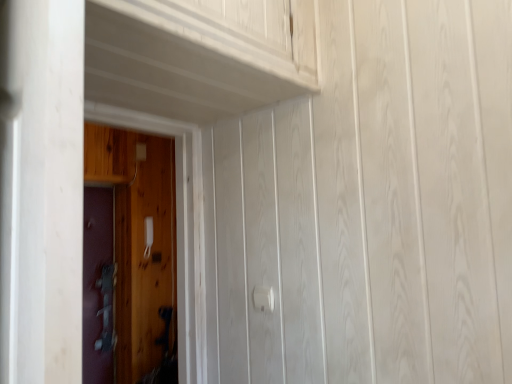
What is the approximate height of white plastic door handle at center?

white plastic door handle at center is 3.18 inches tall.

What is the approximate width of wooden door at left, which is counted as the first door, starting from the front?

wooden door at left, which is counted as the first door, starting from the front, is 5.66 inches wide.

This screenshot has height=384, width=512. I want to click on metallic gray door at left, the 2th door positioned from the right, so click(x=95, y=279).

Is wooden door at left, the 1th door viewed from the right, placed right next to metallic gray door at left, the 2th door positioned from the right?

No, wooden door at left, the 1th door viewed from the right, is not in contact with metallic gray door at left, the 2th door positioned from the right.

How distant is wooden door at left, the 1th door viewed from the right, from metallic gray door at left, which is counted as the 2th door, starting from the front?

wooden door at left, the 1th door viewed from the right, and metallic gray door at left, which is counted as the 2th door, starting from the front, are 9.83 inches apart from each other.

Looking at this image, is wooden door at left, marked as the second door in a back-to-front arrangement, further to camera compared to metallic gray door at left, the first door viewed from the left?

No, wooden door at left, marked as the second door in a back-to-front arrangement, is closer to the camera.

Does wooden door at left, the 2th door in the left-to-right sequence, have a greater width compared to metallic gray door at left, acting as the 1th door starting from the back?

Yes.

Is white plastic door handle at center inside the boundaries of metallic gray door at left, the 2th door positioned from the right, or outside?

white plastic door handle at center is spatially situated outside metallic gray door at left, the 2th door positioned from the right.

Based on their positions, is white plastic door handle at center located to the left or right of metallic gray door at left, acting as the 1th door starting from the back?

Based on their positions, white plastic door handle at center is located to the right of metallic gray door at left, acting as the 1th door starting from the back.

What's the angular difference between white plastic door handle at center and metallic gray door at left, the 2th door positioned from the right,'s facing directions?

white plastic door handle at center and metallic gray door at left, the 2th door positioned from the right, are facing 88.1 degrees away from each other.

Is white plastic door handle at center aimed at metallic gray door at left, the first door viewed from the left?

No, white plastic door handle at center is not aimed at metallic gray door at left, the first door viewed from the left.

Is wooden door at left, the 1th door viewed from the right, in front of or behind white plastic door handle at center in the image?

wooden door at left, the 1th door viewed from the right, is in front of white plastic door handle at center.

Between wooden door at left, marked as the second door in a back-to-front arrangement, and white plastic door handle at center, which one appears on the right side from the viewer's perspective?

Positioned to the right is white plastic door handle at center.

How many degrees apart are the facing directions of wooden door at left, marked as the second door in a back-to-front arrangement, and white plastic door handle at center?

89.7 degrees.

From the image's perspective, which is above, wooden door at left, which is counted as the first door, starting from the front, or white plastic door handle at center?

wooden door at left, which is counted as the first door, starting from the front, is shown above in the image.

Which of these two, metallic gray door at left, the first door viewed from the left, or wooden door at left, the 1th door viewed from the right, is bigger?

wooden door at left, the 1th door viewed from the right.

From a real-world perspective, who is located higher, metallic gray door at left, the 2th door positioned from the right, or wooden door at left, marked as the second door in a back-to-front arrangement?

From a 3D spatial view, wooden door at left, marked as the second door in a back-to-front arrangement, is above.

Relative to wooden door at left, which is counted as the first door, starting from the front, is metallic gray door at left, acting as the 1th door starting from the back, in front or behind?

metallic gray door at left, acting as the 1th door starting from the back, is positioned farther from the viewer than wooden door at left, which is counted as the first door, starting from the front.

From the image's perspective, which one is positioned higher, metallic gray door at left, the 2th door positioned from the right, or wooden door at left, which is counted as the first door, starting from the front?

wooden door at left, which is counted as the first door, starting from the front, from the image's perspective.

Which is correct: metallic gray door at left, the 2th door positioned from the right, is inside white plastic door handle at center, or outside of it?

metallic gray door at left, the 2th door positioned from the right, exists outside the volume of white plastic door handle at center.

Considering the sizes of objects metallic gray door at left, the first door viewed from the left, and white plastic door handle at center in the image provided, who is wider, metallic gray door at left, the first door viewed from the left, or white plastic door handle at center?

metallic gray door at left, the first door viewed from the left.

Which is closer, (x=86, y=357) or (x=269, y=298)?

Point (x=86, y=357) is farther from the camera than point (x=269, y=298).

From a real-world perspective, which is physically above, metallic gray door at left, the 2th door positioned from the right, or white plastic door handle at center?

white plastic door handle at center, from a real-world perspective.

Considering the sizes of objects white plastic door handle at center and wooden door at left, which is counted as the first door, starting from the front, in the image provided, who is thinner, white plastic door handle at center or wooden door at left, which is counted as the first door, starting from the front,?

Thinner between the two is white plastic door handle at center.

Considering the sizes of objects white plastic door handle at center and wooden door at left, the 1th door viewed from the right, in the image provided, who is smaller, white plastic door handle at center or wooden door at left, the 1th door viewed from the right,?

Smaller between the two is white plastic door handle at center.

Which object is positioned more to the left, white plastic door handle at center or wooden door at left, the 1th door viewed from the right?

wooden door at left, the 1th door viewed from the right, is more to the left.

Measure the distance from white plastic door handle at center to wooden door at left, the 2th door in the left-to-right sequence.

white plastic door handle at center is 2.14 meters away from wooden door at left, the 2th door in the left-to-right sequence.

I want to click on door positioned vertically above the metallic gray door at left, which is counted as the 2th door, starting from the front (from a real-world perspective), so click(x=138, y=245).

Identify the location of door handle above the metallic gray door at left, the 2th door positioned from the right (from the image's perspective). The width and height of the screenshot is (512, 384). (263, 299).

Consider the image. Which object lies nearer to the anchor point metallic gray door at left, acting as the 1th door starting from the back, wooden door at left, the 1th door viewed from the right, or white plastic door handle at center?

wooden door at left, the 1th door viewed from the right.

Considering their positions, is wooden door at left, which is counted as the first door, starting from the front, positioned further to white plastic door handle at center than metallic gray door at left, the first door viewed from the left?

metallic gray door at left, the first door viewed from the left, is positioned further to the anchor white plastic door handle at center.

When comparing their distances from white plastic door handle at center, does metallic gray door at left, acting as the 1th door starting from the back, or wooden door at left, which is counted as the first door, starting from the front, seem further?

The object further to white plastic door handle at center is metallic gray door at left, acting as the 1th door starting from the back.

Looking at the image, which one is located closer to wooden door at left, marked as the second door in a back-to-front arrangement, white plastic door handle at center or metallic gray door at left, the 2th door positioned from the right?

Based on the image, metallic gray door at left, the 2th door positioned from the right, appears to be nearer to wooden door at left, marked as the second door in a back-to-front arrangement.

Which object lies nearer to the anchor point wooden door at left, which is counted as the first door, starting from the front, metallic gray door at left, the 2th door positioned from the right, or white plastic door handle at center?

The object closer to wooden door at left, which is counted as the first door, starting from the front, is metallic gray door at left, the 2th door positioned from the right.

When comparing their distances from metallic gray door at left, acting as the 1th door starting from the back, does white plastic door handle at center or wooden door at left, marked as the second door in a back-to-front arrangement, seem further?

white plastic door handle at center is further to metallic gray door at left, acting as the 1th door starting from the back.

Where is `door handle between wooden door at left, the 1th door viewed from the right, and metallic gray door at left, which is counted as the 2th door, starting from the front, from front to back`? door handle between wooden door at left, the 1th door viewed from the right, and metallic gray door at left, which is counted as the 2th door, starting from the front, from front to back is located at coordinates (263, 299).